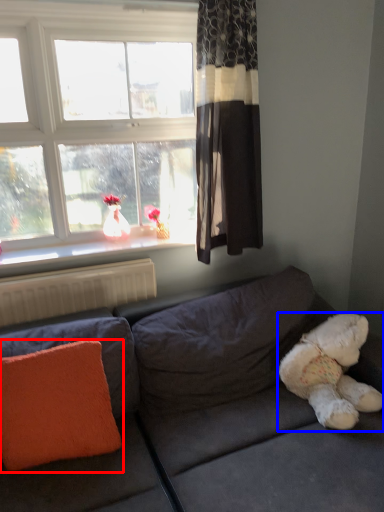
Question: Which of the following is the farthest to the observer, pillow (highlighted by a red box) or teddy bear (highlighted by a blue box)?

Choices:
 (A) pillow
 (B) teddy bear

Answer: (B)